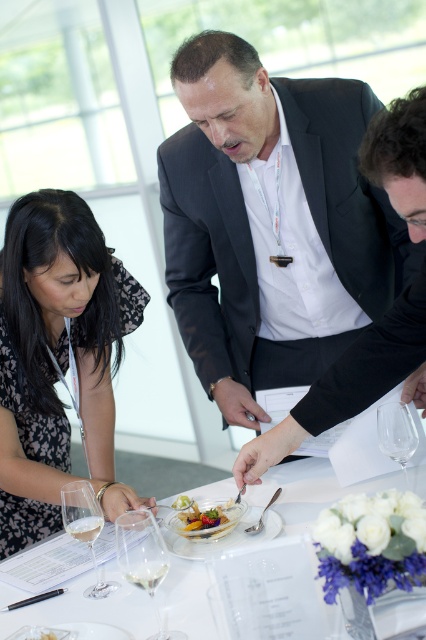
From the picture: You are a guest at this event and want to reach for the clear glass at table center. However, the dark gray suit at center is blocking your view. Can you still access the glass without moving the suit?

The clear glass at table center is behind the dark gray suit at center, so you can access it by moving around the suit or reaching past it, but you would need to ensure not to disturb the suit.

You are a guest at this event and want to reach for the white glossy plate at center and the shiny glass plate at center. Which one is closer to you?

The white glossy plate at center is closer to you because it is below the shiny glass plate at center, meaning it is positioned in front of the other plate.